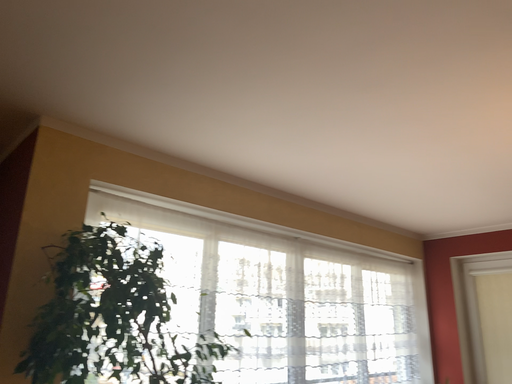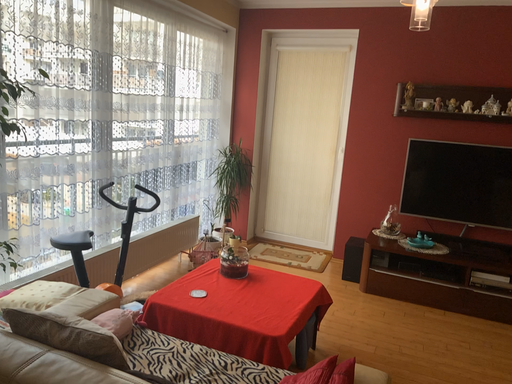
Question: How did the camera likely rotate when shooting the video?

Choices:
 (A) rotated upward
 (B) rotated downward

Answer: (B)